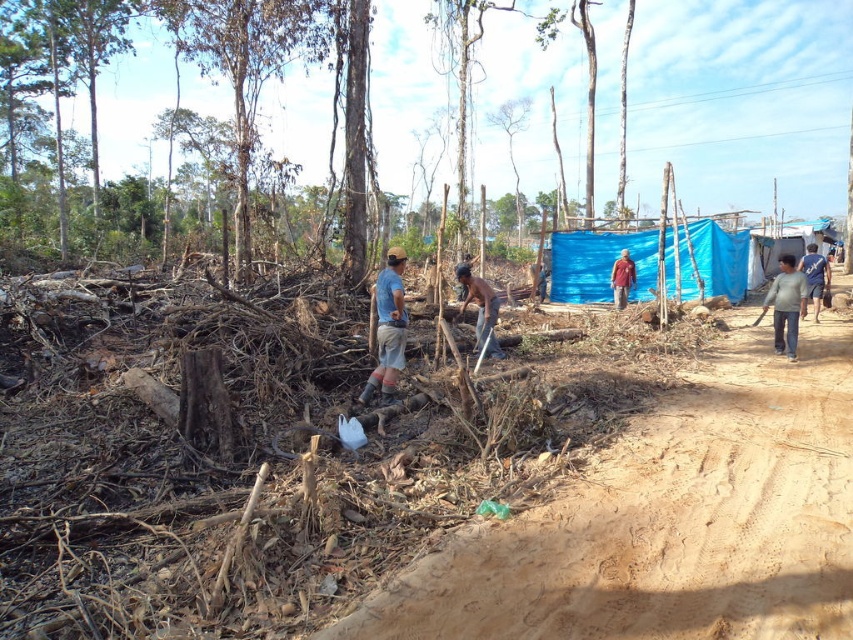
You are a worker in the logging site. You see a blue fabric cap at center and a blue fabric at right. Which one is closer to the ground?

The blue fabric cap at center is positioned under blue fabric at right, so the blue fabric cap at center is closer to the ground.

Based on the photo, you are standing at the logging site and need to determine the distance between two points marked in the scene. Which point is closer to you, point (474, 288) or point (633, 272)?

Point (474, 288) is closer to the viewer than point (633, 272).

You are a safety inspector at the logging site. You notice two blue items in the scene. The first is a blue fabric cap at center, and the second is a blue fabric at right. According to safety regulations, all protective gear must be clearly visible. Which of the two blue items is more likely to be compliant with visibility requirements based on their height?

The blue fabric at right is more likely to be compliant with visibility requirements because it has a greater height compared to the blue fabric cap at center, making it more noticeable from a distance.